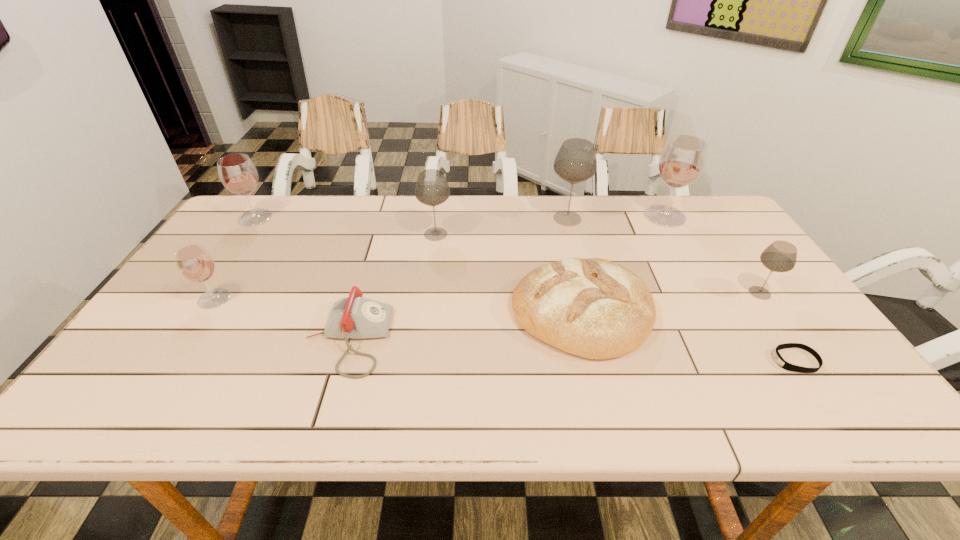
This screenshot has width=960, height=540. I want to click on vacant point located between the smallest red wineglass and the biggest red wineglass, so click(440, 258).

You are a GUI agent. You are given a task and a screenshot of the screen. Output one action in this format:
    pyautogui.click(x=<x>, y=<y>)
    Task: Click on the free space between the wristband and the bread
    
    Given the screenshot: What is the action you would take?
    pyautogui.click(x=688, y=336)

Image resolution: width=960 pixels, height=540 pixels. What are the coordinates of `unoccupied position between the smallest red wineglass and the leftmost gray wineglass` in the screenshot? It's located at (325, 267).

Where is `the seventh closest object relative to the fourth wineglass from left to right`? The height and width of the screenshot is (540, 960). the seventh closest object relative to the fourth wineglass from left to right is located at coordinates (237, 172).

Identify the location of the second closest object to the rightmost gray wineglass. (683, 158).

Where is `wineglass that is the third nearest to the second biggest red wineglass`? The height and width of the screenshot is (540, 960). wineglass that is the third nearest to the second biggest red wineglass is located at coordinates (575, 162).

Locate which wineglass is the sixth closest to the third shortest object. Please provide its 2D coordinates. Your answer should be formatted as a tuple, i.e. [(x, y)], where the tuple contains the x and y coordinates of a point satisfying the conditions above.

[(237, 172)]

The width and height of the screenshot is (960, 540). What are the coordinates of `the second closest red wineglass to the nearest gray wineglass` in the screenshot? It's located at (195, 263).

Point out which red wineglass is positioned as the second nearest to the wristband. Please provide its 2D coordinates. Your answer should be formatted as a tuple, i.e. [(x, y)], where the tuple contains the x and y coordinates of a point satisfying the conditions above.

[(195, 263)]

You are a GUI agent. You are given a task and a screenshot of the screen. Output one action in this format:
    pyautogui.click(x=<x>, y=<y>)
    Task: Click on the second closest gray wineglass to the third shortest object
    The width and height of the screenshot is (960, 540).
    Given the screenshot: What is the action you would take?
    pyautogui.click(x=432, y=189)